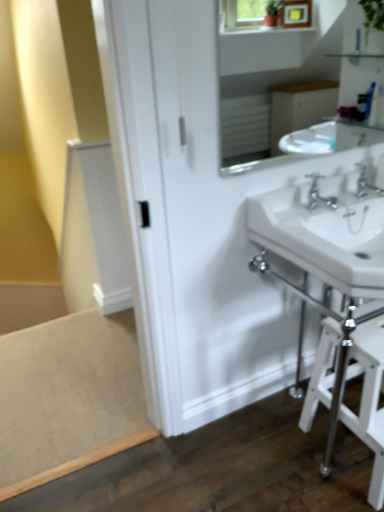
This screenshot has height=512, width=384. I want to click on vacant space that is to the left of white glossy table at lower right, so click(231, 459).